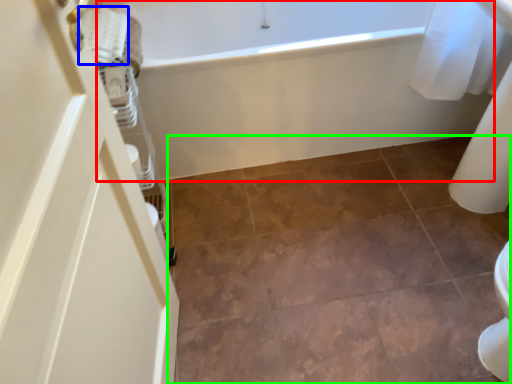
Question: Which object is positioned farthest from bathtub (highlighted by a red box)? Select from material (highlighted by a blue box) and ceramic tile (highlighted by a green box).

Choices:
 (A) material
 (B) ceramic tile

Answer: (A)